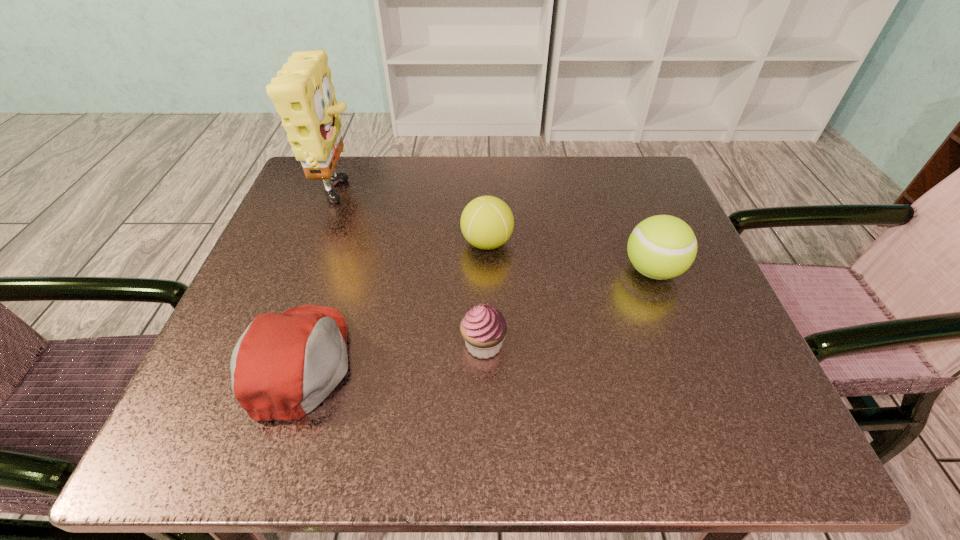
Locate an element on the screen. The width and height of the screenshot is (960, 540). free space in the image that satisfies the following two spatial constraints: 1. on the face of the sponge; 2. on the back side of the left tennis ball is located at coordinates (322, 243).